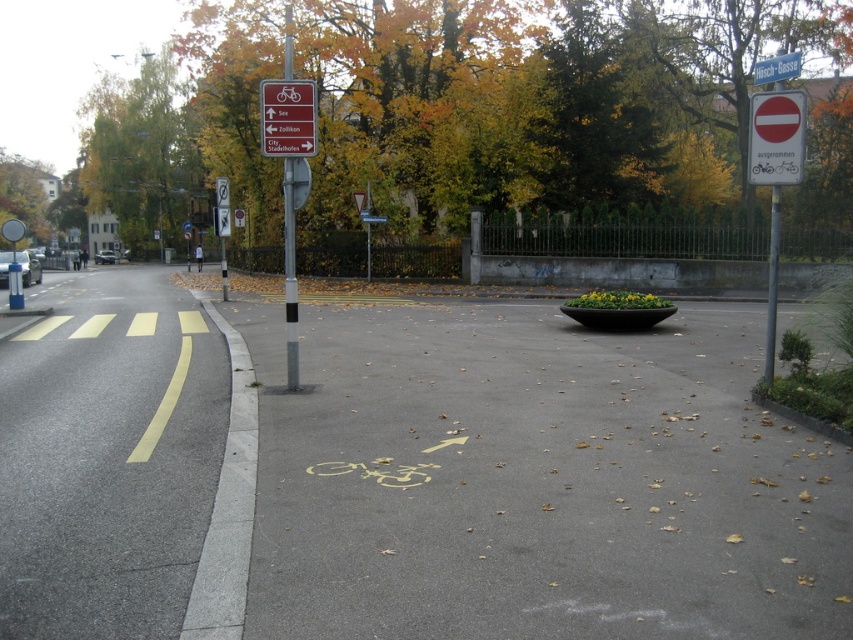
Does red matte stop sign at upper right have a larger size compared to white plastic sign at upper center?

Incorrect, red matte stop sign at upper right is not larger than white plastic sign at upper center.

Does point (798, 124) come farther from viewer compared to point (769, 67)?

That is False.

The width and height of the screenshot is (853, 640). What do you see at coordinates (776, 138) in the screenshot?
I see `red matte stop sign at upper right` at bounding box center [776, 138].

This screenshot has height=640, width=853. Find the location of `red matte stop sign at upper right`. red matte stop sign at upper right is located at coordinates (776, 138).

Is red matte stop sign at upper right thinner than red plastic sign at upper center?

Yes.

Is point (802, 154) less distant than point (302, 136)?

Yes.

Locate an element on the screen. This screenshot has height=640, width=853. red matte stop sign at upper right is located at coordinates (776, 138).

The width and height of the screenshot is (853, 640). What are the coordinates of `red matte stop sign at upper right` in the screenshot? It's located at (776, 138).

Who is more distant from viewer, (627, 564) or (749, 134)?

The point (749, 134) is behind.

Could you measure the distance between yellow painted bicycle lane at lower center and red matte stop sign at upper right?

→ They are 14.16 feet apart.

Image resolution: width=853 pixels, height=640 pixels. In order to click on yellow painted bicycle lane at lower center in this screenshot , I will do `click(537, 481)`.